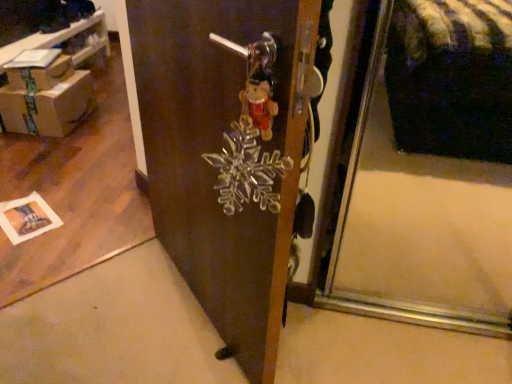
Question: Can you confirm if brown cardboard box at upper left is positioned to the right of brown cardboard boxes at left?

Choices:
 (A) yes
 (B) no

Answer: (A)

Question: Is brown cardboard box at upper left positioned with its back to brown cardboard boxes at left?

Choices:
 (A) no
 (B) yes

Answer: (B)

Question: Considering the relative sizes of brown cardboard box at upper left and brown cardboard boxes at left in the image provided, is brown cardboard box at upper left shorter than brown cardboard boxes at left?

Choices:
 (A) no
 (B) yes

Answer: (B)

Question: Is brown cardboard box at upper left at the left side of brown cardboard boxes at left?

Choices:
 (A) yes
 (B) no

Answer: (B)

Question: Can brown cardboard boxes at left be found inside brown cardboard box at upper left?

Choices:
 (A) no
 (B) yes

Answer: (A)

Question: Can you confirm if brown cardboard box at upper left is thinner than brown cardboard boxes at left?

Choices:
 (A) no
 (B) yes

Answer: (B)

Question: Is brown cardboard boxes at left thinner than brown cardboard box at upper left?

Choices:
 (A) no
 (B) yes

Answer: (A)

Question: From a real-world perspective, does brown cardboard boxes at left stand above brown cardboard box at upper left?

Choices:
 (A) yes
 (B) no

Answer: (B)

Question: Is brown cardboard boxes at left positioned beyond the bounds of brown cardboard box at upper left?

Choices:
 (A) no
 (B) yes

Answer: (B)

Question: Is brown cardboard boxes at left smaller than brown cardboard box at upper left?

Choices:
 (A) yes
 (B) no

Answer: (B)

Question: Does brown cardboard boxes at left turn towards brown cardboard box at upper left?

Choices:
 (A) yes
 (B) no

Answer: (A)

Question: From the image's perspective, is brown cardboard boxes at left above brown cardboard box at upper left?

Choices:
 (A) yes
 (B) no

Answer: (A)

Question: From the image's perspective, is brown cardboard boxes at left below cardboard box at left?

Choices:
 (A) yes
 (B) no

Answer: (B)